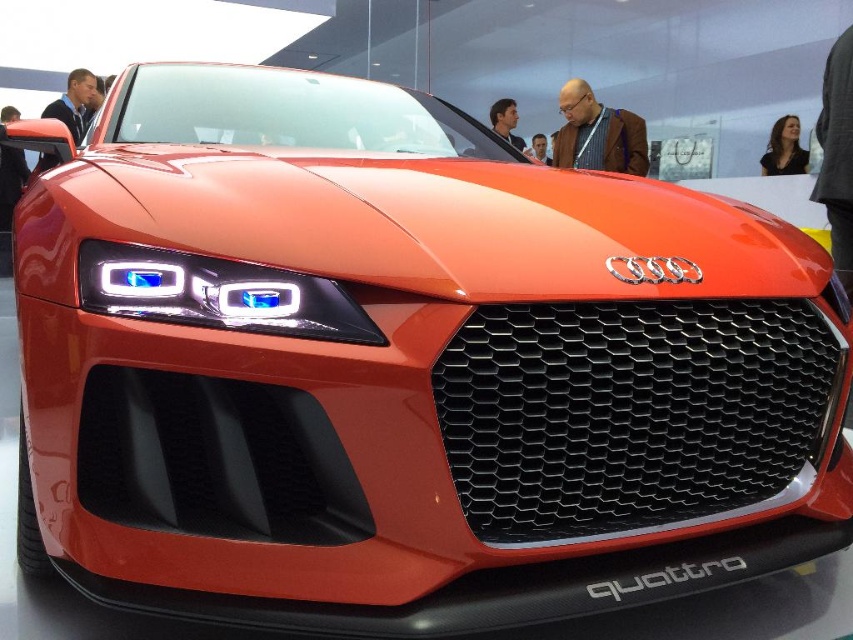
Does matte plastic headlight at center come in front of shiny orange car at center?

Yes, matte plastic headlight at center is in front of shiny orange car at center.

Does matte plastic headlight at center appear on the left side of shiny orange car at center?

Yes, matte plastic headlight at center is to the left of shiny orange car at center.

At what (x,y) coordinates should I click in order to perform the action: click on matte plastic headlight at center. Please return your answer as a coordinate pair (x, y). Looking at the image, I should click on (218, 292).